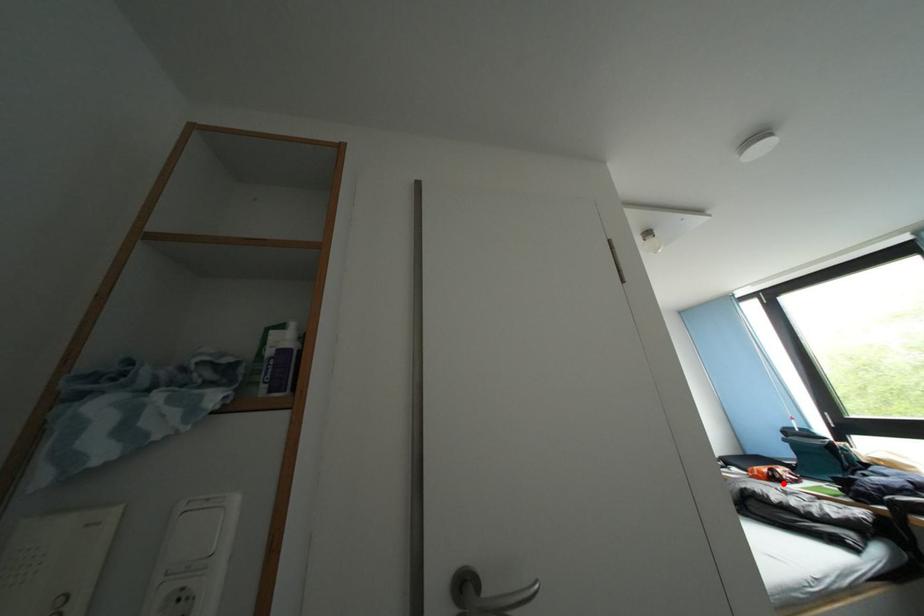
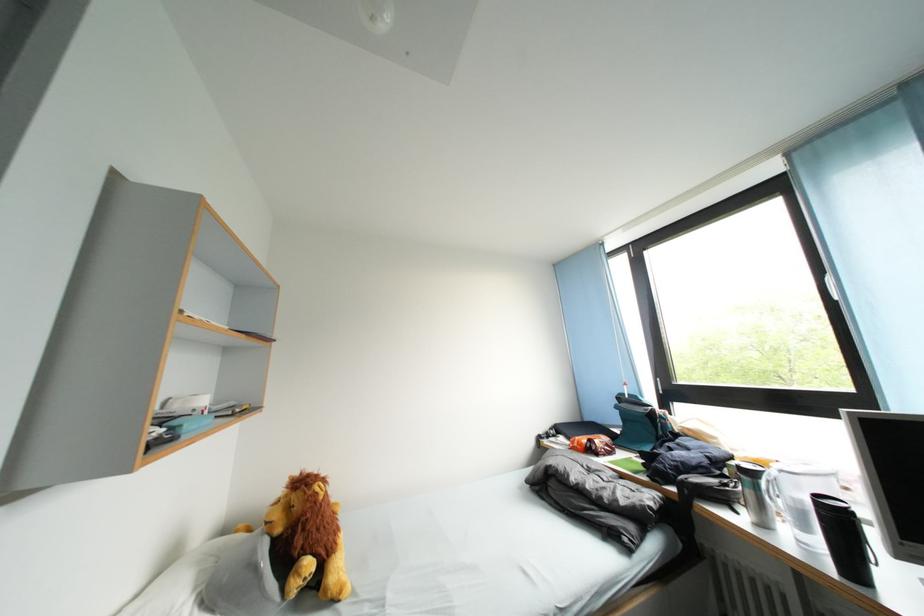
Question: I am providing you with two images of the same scene from different viewpoints. Given a red point in image1, look at the same physical point in image2. Is it:

Choices:
 (A) Closer to the viewpoint
 (B) Farther from the viewpoint

Answer: (B)